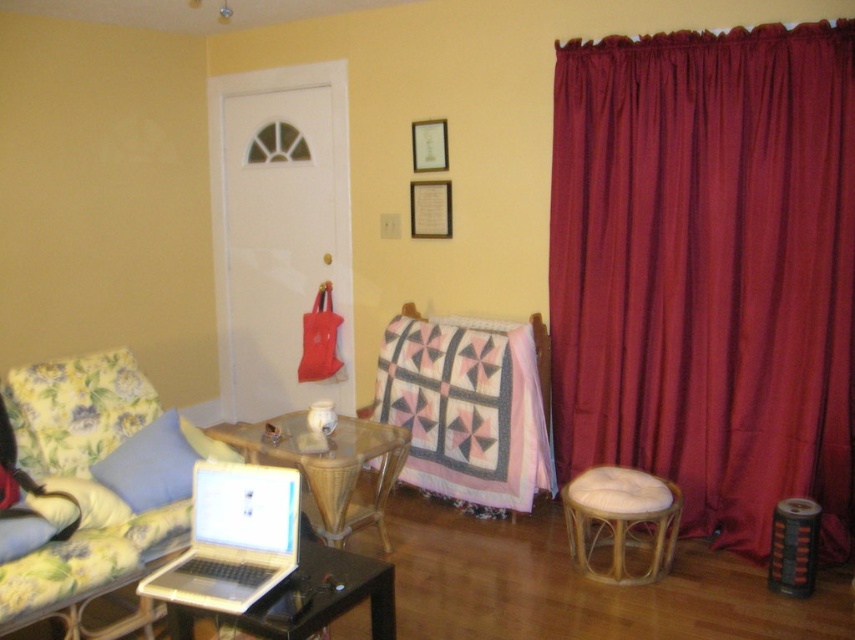
Which is below, white glossy table at center or rattan/wooden stool at lower right?

rattan/wooden stool at lower right is below.

Who is more distant from viewer, (313, 545) or (581, 554)?

The point (581, 554) is behind.

At what (x,y) coordinates should I click in order to perform the action: click on white glossy table at center. Please return your answer as a coordinate pair (x, y). The image size is (855, 640). Looking at the image, I should click on (310, 598).

How far apart are white glossy table at center and blue fabric pillow at left?

They are 29.77 inches apart.

Can you confirm if white glossy table at center is thinner than blue fabric pillow at left?

Incorrect, white glossy table at center's width is not less than blue fabric pillow at left's.

Describe the element at coordinates (310, 598) in the screenshot. This screenshot has width=855, height=640. I see `white glossy table at center` at that location.

The width and height of the screenshot is (855, 640). In order to click on white glossy table at center in this screenshot , I will do `click(310, 598)`.

Who is taller, pink quilted blanket at center or white glossy table at center?

Standing taller between the two is pink quilted blanket at center.

Who is positioned more to the left, pink quilted blanket at center or white glossy table at center?

white glossy table at center

You are a GUI agent. You are given a task and a screenshot of the screen. Output one action in this format:
    pyautogui.click(x=<x>, y=<y>)
    Task: Click on the pink quilted blanket at center
    The height and width of the screenshot is (640, 855).
    Given the screenshot: What is the action you would take?
    pyautogui.click(x=467, y=412)